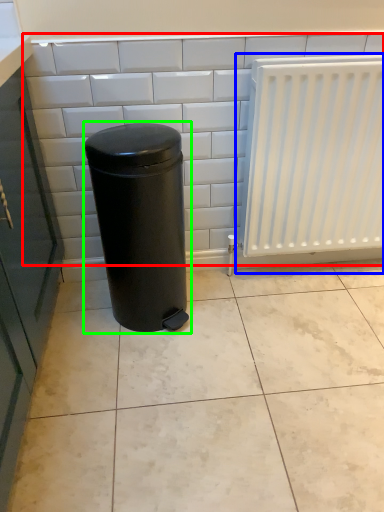
Question: Considering the real-world distances, which object is closest to ceramic tile (highlighted by a red box)? radiator (highlighted by a blue box) or waste container (highlighted by a green box).

Choices:
 (A) radiator
 (B) waste container

Answer: (B)